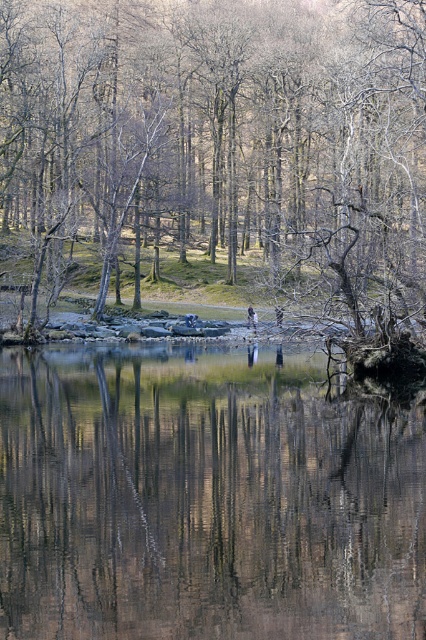
Is brown matte tree at center thinner than transparent water at center?

No.

Is point (147, 268) closer to viewer compared to point (313, 586)?

No.

Find the location of a particular element. Image resolution: width=426 pixels, height=640 pixels. brown matte tree at center is located at coordinates (215, 154).